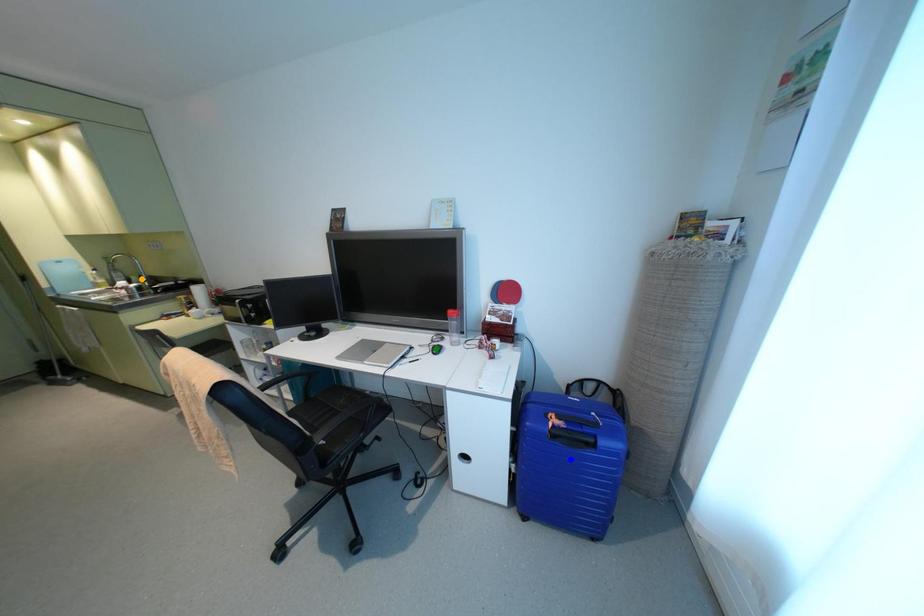
Order these from farthest to nearest:
blue point | orange point | green point

orange point → green point → blue point